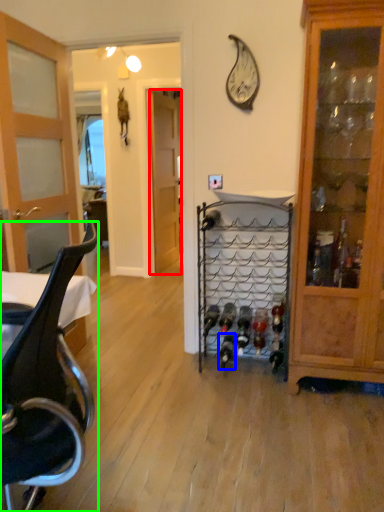
Question: Which object is positioned farthest from door (highlighted by a red box)? Select from wine bottle (highlighted by a blue box) and chair (highlighted by a green box).

Choices:
 (A) wine bottle
 (B) chair

Answer: (B)